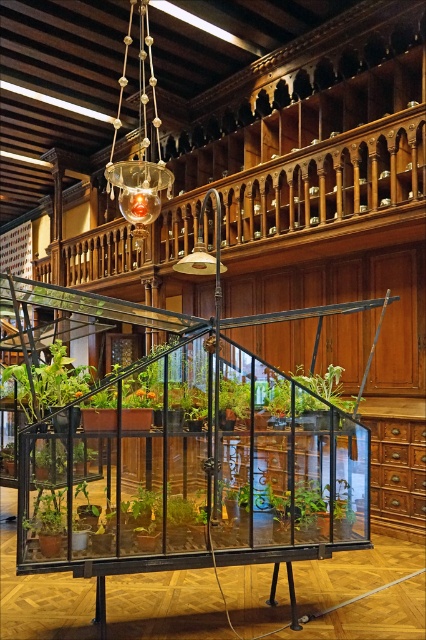
Does green leafy plant at center have a lesser height compared to green matte plant at center?

In fact, green leafy plant at center may be taller than green matte plant at center.

Consider the image. Does green leafy plant at center appear under green matte plant at center?

Yes, green leafy plant at center is below green matte plant at center.

Is point (339, 392) farther from viewer compared to point (233, 417)?

Yes, point (339, 392) is farther from viewer.

Image resolution: width=426 pixels, height=640 pixels. I want to click on green leafy plant at center, so click(x=325, y=385).

Is translucent glass chandelier at upper center to the right of green matte plant at lower left from the viewer's perspective?

Yes, translucent glass chandelier at upper center is to the right of green matte plant at lower left.

I want to click on translucent glass chandelier at upper center, so click(x=138, y=144).

Consider the image. Can you confirm if green matte plant at lower left is positioned to the right of green matte plant at center?

Incorrect, green matte plant at lower left is not on the right side of green matte plant at center.

Which is above, green matte plant at lower left or green matte plant at center?

Result: green matte plant at center is higher up.

Between point (57, 508) and point (236, 404), which one is positioned in front?

Point (57, 508)

Identify the location of green matte plant at lower left. The height and width of the screenshot is (640, 426). (46, 513).